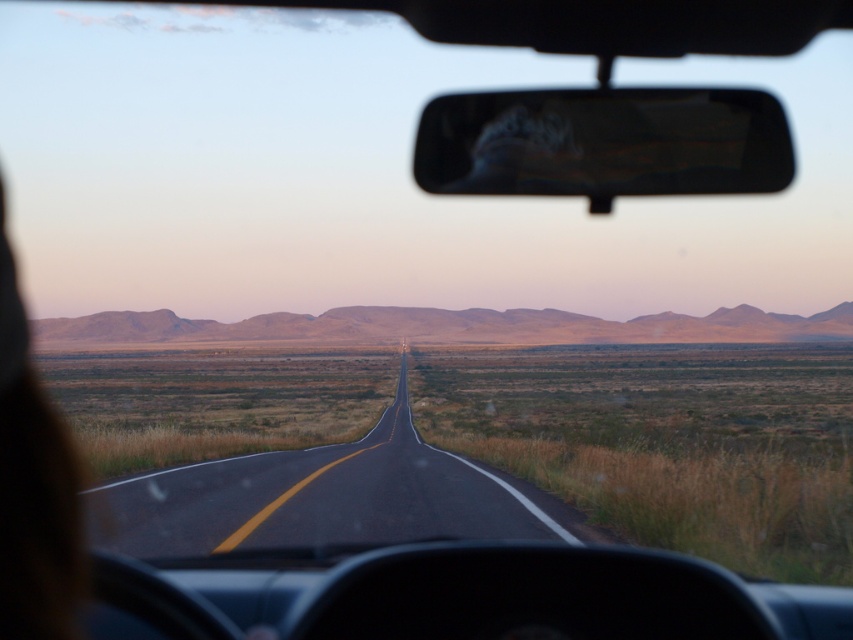
Question: Which point is closer to the camera?

Choices:
 (A) (440, 474)
 (B) (676, 125)

Answer: (B)

Question: Which object is farther from the camera taking this photo?

Choices:
 (A) black glossy view mirror at upper center
 (B) asphalt road at center

Answer: (B)

Question: In this image, where is asphalt road at center located relative to black glossy view mirror at upper center?

Choices:
 (A) right
 (B) left

Answer: (B)

Question: Does asphalt road at center appear on the right side of black glossy view mirror at upper center?

Choices:
 (A) yes
 (B) no

Answer: (B)

Question: Which point is closer to the camera?

Choices:
 (A) (416, 522)
 (B) (448, 96)

Answer: (B)

Question: Can you confirm if asphalt road at center is positioned above black glossy view mirror at upper center?

Choices:
 (A) no
 (B) yes

Answer: (A)